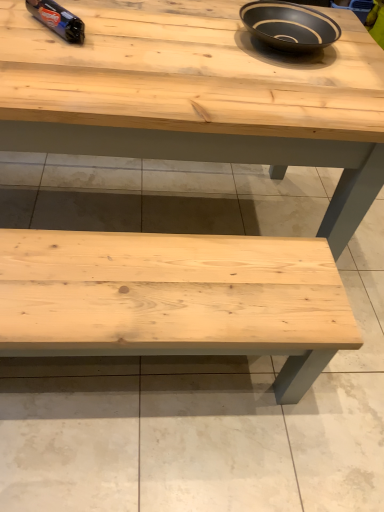
Where is `free space to the right of black matte bowl at upper center`? This screenshot has width=384, height=512. free space to the right of black matte bowl at upper center is located at coordinates (359, 52).